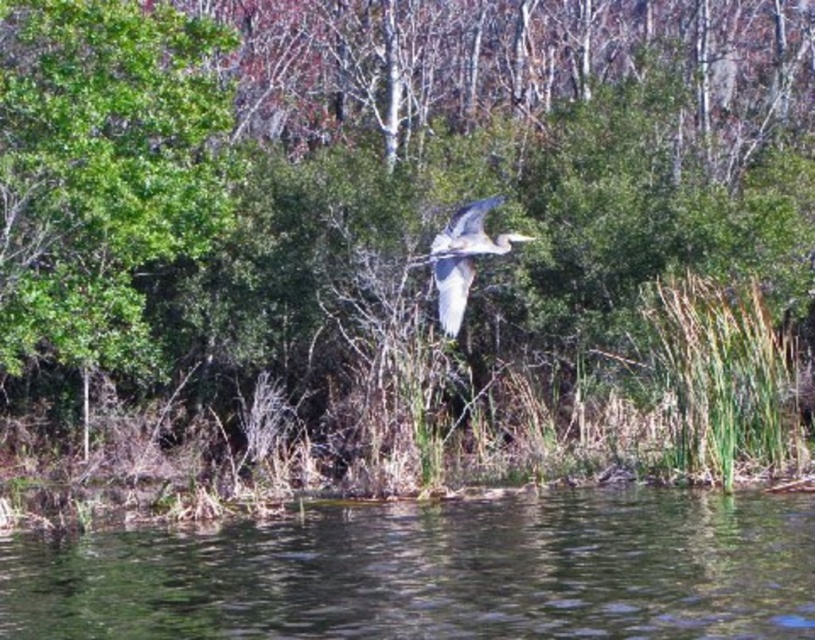
Does clear water at lower center appear on the left side of gray feathered heron at center?

Incorrect, clear water at lower center is not on the left side of gray feathered heron at center.

The width and height of the screenshot is (815, 640). Find the location of `clear water at lower center`. clear water at lower center is located at coordinates (435, 572).

Where is `clear water at lower center`? clear water at lower center is located at coordinates (435, 572).

What do you see at coordinates (379, 180) in the screenshot? Image resolution: width=815 pixels, height=640 pixels. I see `green leafy tree at upper center` at bounding box center [379, 180].

Does green leafy tree at upper center appear on the right side of gray feathered heron at center?

Correct, you'll find green leafy tree at upper center to the right of gray feathered heron at center.

Looking at this image, who is more distant from viewer, (622, 344) or (452, 248)?

The point (622, 344) is behind.

Where is `green leafy tree at upper center`? This screenshot has height=640, width=815. green leafy tree at upper center is located at coordinates (379, 180).

Does green leafy tree at upper center have a lesser height compared to clear water at lower center?

No, green leafy tree at upper center is not shorter than clear water at lower center.

The image size is (815, 640). What are the coordinates of `green leafy tree at upper center` in the screenshot? It's located at (379, 180).